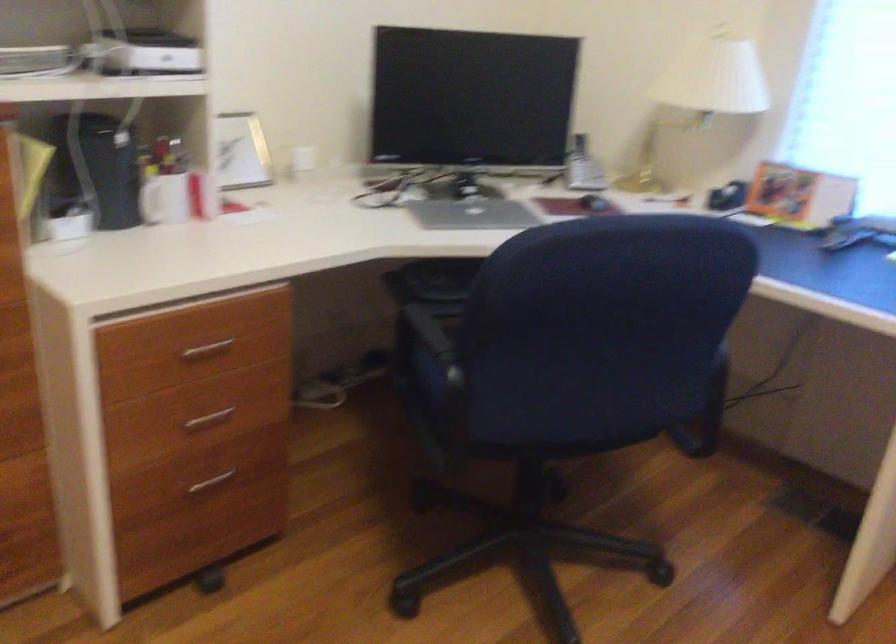
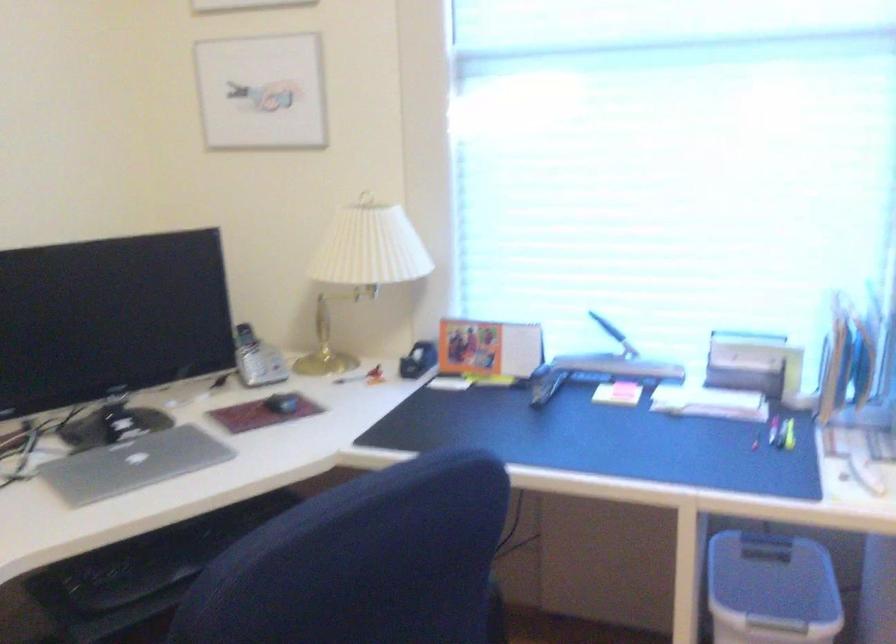
Question: What movement of the cameraman would produce the second image?

Choices:
 (A) Left
 (B) Right
 (C) Forward
 (D) Backward

Answer: (C)